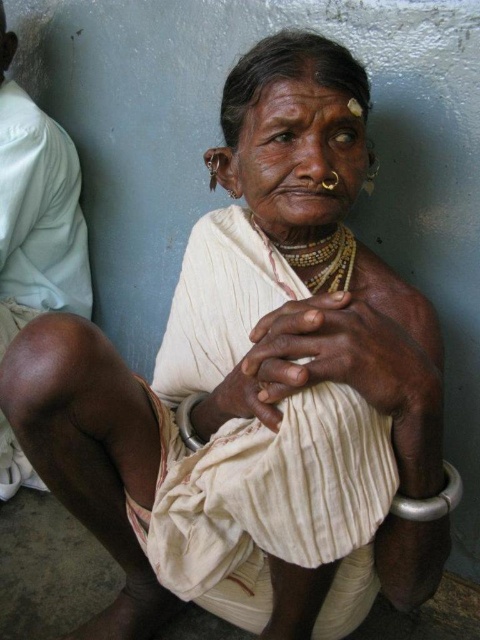
Question: Considering the real-world distances, which object is closest to the silver metallic bracelet at lower center?

Choices:
 (A) silver metallic bracelet at lower right
 (B) brown skin at lower left
 (C) dry skin at center

Answer: (A)

Question: Which of the following is the farthest from the observer?

Choices:
 (A) (87, 317)
 (B) (292, 259)

Answer: (A)

Question: Does gold beaded necklace at center appear over silver metallic bracelet at lower center?

Choices:
 (A) no
 (B) yes

Answer: (B)

Question: Does dry skin at center appear on the left side of silver metallic bracelet at lower center?

Choices:
 (A) yes
 (B) no

Answer: (B)

Question: Does dry skin at center appear on the right side of silver metallic bracelet at lower center?

Choices:
 (A) no
 (B) yes

Answer: (B)

Question: Which object appears closest to the camera in this image?

Choices:
 (A) gold beaded necklace at center
 (B) brown skin at lower left

Answer: (A)